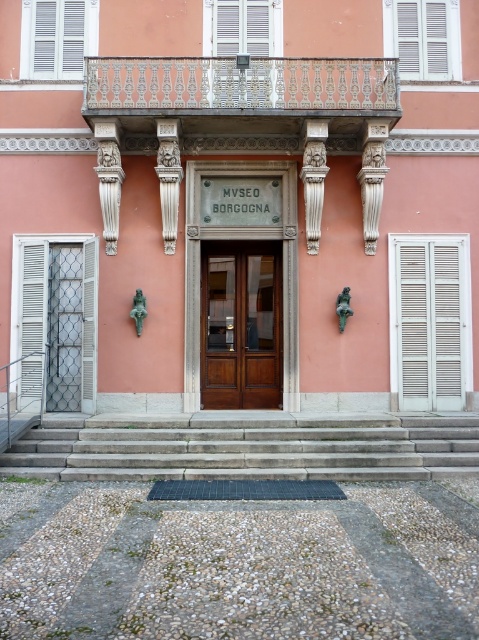
Image resolution: width=479 pixels, height=640 pixels. Describe the element at coordinates (248, 448) in the screenshot. I see `gray concrete stairs at center` at that location.

Who is taller, gray concrete stairs at center or white textured shutter at left?

white textured shutter at left is taller.

Does point (174, 474) lie in front of point (25, 252)?

Yes, point (174, 474) is closer to viewer.

Where is `gray concrete stairs at center`? The height and width of the screenshot is (640, 479). gray concrete stairs at center is located at coordinates (248, 448).

Is gray concrete stairs at center smaller than white matte shutter at upper center?

No.

In order to click on gray concrete stairs at center in this screenshot , I will do `click(248, 448)`.

Locate an element on the screen. The height and width of the screenshot is (640, 479). gray concrete stairs at center is located at coordinates (248, 448).

Which is below, white wooden shutters at right or white matte shutter at upper right?

white wooden shutters at right

What do you see at coordinates (430, 321) in the screenshot? I see `white wooden shutters at right` at bounding box center [430, 321].

In order to click on white wooden shutters at right in this screenshot , I will do `click(430, 321)`.